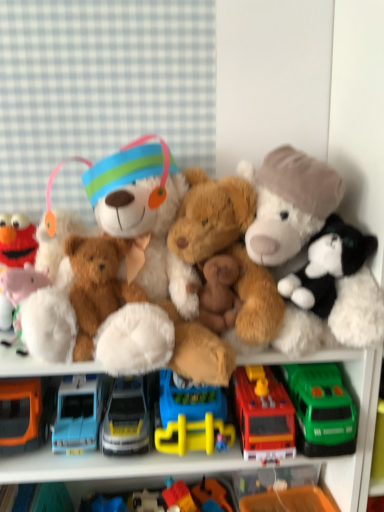
You are a GUI agent. You are given a task and a screenshot of the screen. Output one action in this format:
    pyautogui.click(x=<x>, y=<y>)
    Task: Click on the plastic toy car at center, which ranks as the 7th toy in right-to-left order
    
    Given the screenshot: What is the action you would take?
    pyautogui.click(x=146, y=502)

Measure the distance between point (252, 255) and camera.

Point (252, 255) and camera are 32.20 inches apart from each other.

Identify the location of brown plush bear at center, arranged as the fifth toy when viewed from the left. The image size is (384, 512). (218, 293).

Locate an element on the screen. This screenshot has width=384, height=512. plastic toy car at center, which ranks as the 7th toy in right-to-left order is located at coordinates (146, 502).

Considering the sizes of objects rubber duck at center, the fourth toy viewed from the right, and brown plush bear at center, the second toy in the left-to-right sequence, in the image provided, who is bigger, rubber duck at center, the fourth toy viewed from the right, or brown plush bear at center, the second toy in the left-to-right sequence,?

With larger size is brown plush bear at center, the second toy in the left-to-right sequence.

Could you tell me if rubber duck at center, marked as the 6th toy in a left-to-right arrangement, is turned towards brown plush bear at center, the second toy in the left-to-right sequence?

No, rubber duck at center, marked as the 6th toy in a left-to-right arrangement, is not oriented towards brown plush bear at center, the second toy in the left-to-right sequence.

From the image's perspective, is rubber duck at center, marked as the 6th toy in a left-to-right arrangement, located above brown plush bear at center, the second toy in the left-to-right sequence?

No, from the image's perspective, rubber duck at center, marked as the 6th toy in a left-to-right arrangement, is not over brown plush bear at center, the second toy in the left-to-right sequence.

Is rubber duck at center, marked as the 6th toy in a left-to-right arrangement, far away from brown plush bear at center, the 8th toy when ordered from right to left?

They are positioned close to each other.

Is fluffy brown teddy bear at center, the 3th toy positioned from the right, touching blue plastic toy truck at center, which is the third truck in right-to-left order?

No, fluffy brown teddy bear at center, the 3th toy positioned from the right, is not next to blue plastic toy truck at center, which is the third truck in right-to-left order.

Considering the sizes of objects fluffy brown teddy bear at center, the 3th toy positioned from the right, and blue plastic toy truck at center, which is the third truck in right-to-left order, in the image provided, who is shorter, fluffy brown teddy bear at center, the 3th toy positioned from the right, or blue plastic toy truck at center, which is the third truck in right-to-left order,?

With less height is blue plastic toy truck at center, which is the third truck in right-to-left order.

Choose the correct answer: Is fluffy brown teddy bear at center, the 3th toy positioned from the right, inside blue plastic toy truck at center, placed as the 3th truck when sorted from left to right, or outside it?

fluffy brown teddy bear at center, the 3th toy positioned from the right, is located beyond the bounds of blue plastic toy truck at center, placed as the 3th truck when sorted from left to right.

Which point is more forward, (179,217) or (163,397)?

The point (179,217) is in front.

Considering the sizes of objects black plush cat at right, acting as the ninth toy starting from the left, and shiny silver truck at center, marked as the 2th truck in a left-to-right arrangement, in the image provided, who is smaller, black plush cat at right, acting as the ninth toy starting from the left, or shiny silver truck at center, marked as the 2th truck in a left-to-right arrangement,?

shiny silver truck at center, marked as the 2th truck in a left-to-right arrangement.

How different are the orientations of black plush cat at right, marked as the first toy in a right-to-left arrangement, and shiny silver truck at center, marked as the 2th truck in a left-to-right arrangement, in degrees?

The angle between the facing direction of black plush cat at right, marked as the first toy in a right-to-left arrangement, and the facing direction of shiny silver truck at center, marked as the 2th truck in a left-to-right arrangement, is 88.1 degrees.

Is black plush cat at right, marked as the first toy in a right-to-left arrangement, behind shiny silver truck at center, which appears as the 4th truck when viewed from the right?

No, the depth of black plush cat at right, marked as the first toy in a right-to-left arrangement, is less than that of shiny silver truck at center, which appears as the 4th truck when viewed from the right.

Identify the location of the 3rd truck counting from the left of the black plush cat at right, marked as the first toy in a right-to-left arrangement. (126, 419).

From the plastic toy car at center, which ranks as the 7th toy in right-to-left order, count 2nd toy to the right and point to it. Please provide its 2D coordinates.

[(218, 293)]

Can you confirm if brown plush bear at center, arranged as the fifth toy when viewed from the left, is wider than plastic toy car at center, the 3th toy in the left-to-right sequence?

In fact, brown plush bear at center, arranged as the fifth toy when viewed from the left, might be narrower than plastic toy car at center, the 3th toy in the left-to-right sequence.

Which object is further away from the camera, brown plush bear at center, arranged as the fifth toy when viewed from the left, or plastic toy car at center, the 3th toy in the left-to-right sequence?

plastic toy car at center, the 3th toy in the left-to-right sequence, is behind.

Is brown plush bear at center, arranged as the 5th toy when viewed from the right, positioned far away from plastic toy car at center, which ranks as the 7th toy in right-to-left order?

brown plush bear at center, arranged as the 5th toy when viewed from the right, is near plastic toy car at center, which ranks as the 7th toy in right-to-left order, not far away.

The width and height of the screenshot is (384, 512). I want to click on the 1st toy below the white plush pig at left, placed as the 9th toy when sorted from right to left (from the image's perspective), so click(x=179, y=497).

Which is closer, (175,493) or (13,282)?

The point (13,282) is closer to the camera.

From the image's perspective, is rubberized plastic toy at center, which is the fourth toy from left to right, on white plush pig at left, placed as the 1th toy when sorted from left to right?

Incorrect, from the image's perspective, rubberized plastic toy at center, which is the fourth toy from left to right, is lower than white plush pig at left, placed as the 1th toy when sorted from left to right.

Is rubberized plastic toy at center, the 6th toy in the right-to-left sequence, further to the viewer compared to white plush pig at left, placed as the 1th toy when sorted from left to right?

Yes, rubberized plastic toy at center, the 6th toy in the right-to-left sequence, is further from the viewer.

Is brown plush bear at center, the second toy in the left-to-right sequence, to the left of brown plush bear at center, arranged as the fifth toy when viewed from the left, from the viewer's perspective?

Indeed, brown plush bear at center, the second toy in the left-to-right sequence, is positioned on the left side of brown plush bear at center, arranged as the fifth toy when viewed from the left.

Is brown plush bear at center, the 8th toy when ordered from right to left, located outside brown plush bear at center, arranged as the fifth toy when viewed from the left?

brown plush bear at center, the 8th toy when ordered from right to left, lies outside brown plush bear at center, arranged as the fifth toy when viewed from the left,'s area.

Are brown plush bear at center, the 8th toy when ordered from right to left, and brown plush bear at center, arranged as the fifth toy when viewed from the left, located far from each other?

No, there isn't a large distance between brown plush bear at center, the 8th toy when ordered from right to left, and brown plush bear at center, arranged as the fifth toy when viewed from the left.

Is brown plush bear at center, the 8th toy when ordered from right to left, in front of brown plush bear at center, arranged as the fifth toy when viewed from the left?

Yes.

Which object is closer to the camera, shiny red plastic truck at center, the second truck viewed from the right, or green plastic truck at lower right, which is the first truck from right to left?

green plastic truck at lower right, which is the first truck from right to left, is in front.

Between shiny red plastic truck at center, the second truck viewed from the right, and green plastic truck at lower right, which is the first truck from right to left, which one appears on the left side from the viewer's perspective?

shiny red plastic truck at center, the second truck viewed from the right, is more to the left.

How different are the orientations of shiny red plastic truck at center, the fourth truck from the left, and green plastic truck at lower right, the fifth truck viewed from the left, in degrees?

0.000512 degrees.

Is point (271, 415) farther from camera compared to point (308, 436)?

Yes.

Locate an element on the screen. This screenshot has height=512, width=384. the 4th toy located above the rubber duck at center, marked as the 6th toy in a left-to-right arrangement (from a real-world perspective) is located at coordinates (97, 286).

From a real-world perspective, starting from the fluffy brown teddy bear at center, marked as the 7th toy in a left-to-right arrangement, which truck is the 2nd one below it? Please provide its 2D coordinates.

[(190, 417)]

Considering their positions, is fluffy brown teddy bear at center, the 3th toy positioned from the right, positioned closer to plastic toy car at center, which ranks as the 7th toy in right-to-left order, than white plush pig at left, placed as the 1th toy when sorted from left to right?

white plush pig at left, placed as the 1th toy when sorted from left to right, is closer to plastic toy car at center, which ranks as the 7th toy in right-to-left order.

Looking at the image, which one is located further to green plastic truck at lower right, which is the first truck from right to left, plastic toy car at center, which ranks as the 7th toy in right-to-left order, or white plush pig at left, placed as the 1th toy when sorted from left to right?

white plush pig at left, placed as the 1th toy when sorted from left to right, is further to green plastic truck at lower right, which is the first truck from right to left.

Considering their positions, is shiny red plastic truck at center, the second truck viewed from the right, positioned closer to fluffy white teddy bear at center than white plush pig at left, placed as the 1th toy when sorted from left to right?

white plush pig at left, placed as the 1th toy when sorted from left to right, is closer to fluffy white teddy bear at center.

From the image, which object appears to be nearer to blue plastic toy truck at center, placed as the 3th truck when sorted from left to right, fluffy white teddy bear at center or fluffy white stuffed animal at right, which is the 8th toy from left to right?

Among the two, fluffy white teddy bear at center is located nearer to blue plastic toy truck at center, placed as the 3th truck when sorted from left to right.

Considering their positions, is white plush pig at left, placed as the 9th toy when sorted from right to left, positioned further to brown plush bear at center, arranged as the fifth toy when viewed from the left, than fluffy white stuffed animal at right, which is the 8th toy from left to right?

white plush pig at left, placed as the 9th toy when sorted from right to left.

Based on their spatial positions, is blue plastic toy truck at center, placed as the 1th truck when sorted from left to right, or plastic toy car at center, the 3th toy in the left-to-right sequence, closer to fluffy white teddy bear at center?

Based on the image, blue plastic toy truck at center, placed as the 1th truck when sorted from left to right, appears to be nearer to fluffy white teddy bear at center.

Which object lies nearer to the anchor point fluffy brown teddy bear at center, marked as the 7th toy in a left-to-right arrangement, fluffy white teddy bear at center or brown plush bear at center, arranged as the 5th toy when viewed from the right?

brown plush bear at center, arranged as the 5th toy when viewed from the right.

Which object lies nearer to the anchor point black plush cat at right, acting as the ninth toy starting from the left, brown plush bear at center, arranged as the fifth toy when viewed from the left, or shiny silver truck at center, which appears as the 4th truck when viewed from the right?

The object closer to black plush cat at right, acting as the ninth toy starting from the left, is brown plush bear at center, arranged as the fifth toy when viewed from the left.

Where is `toy between shiny red plastic truck at center, the second truck viewed from the right, and rubber duck at center, the fourth toy viewed from the right, in the up-down direction`? The width and height of the screenshot is (384, 512). toy between shiny red plastic truck at center, the second truck viewed from the right, and rubber duck at center, the fourth toy viewed from the right, in the up-down direction is located at coordinates (179, 497).

You are a GUI agent. You are given a task and a screenshot of the screen. Output one action in this format:
    pyautogui.click(x=<x>, y=<y>)
    Task: Click on the toy that lies between brown plush bear at center, arranged as the fifth toy when viewed from the left, and rubberized plastic toy at center, the 6th toy in the right-to-left sequence, from top to bottom
    The height and width of the screenshot is (512, 384).
    Given the screenshot: What is the action you would take?
    pyautogui.click(x=21, y=288)

Locate an element on the screen. teddy bear between white plush pig at left, placed as the 9th toy when sorted from right to left, and green plastic truck at lower right, which is the first truck from right to left, in the horizontal direction is located at coordinates (182, 288).

Find the location of a particular element. This screenshot has width=384, height=512. teddy bear between brown plush bear at center, the 8th toy when ordered from right to left, and black plush cat at right, marked as the first toy in a right-to-left arrangement is located at coordinates (182, 288).